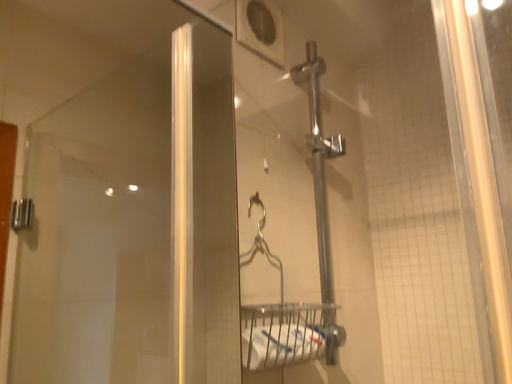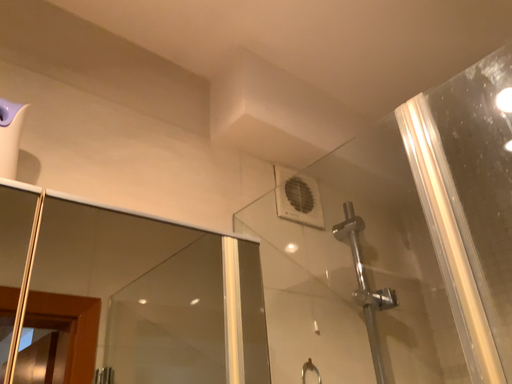
Question: How did the camera likely rotate when shooting the video?

Choices:
 (A) rotated downward
 (B) rotated upward

Answer: (B)